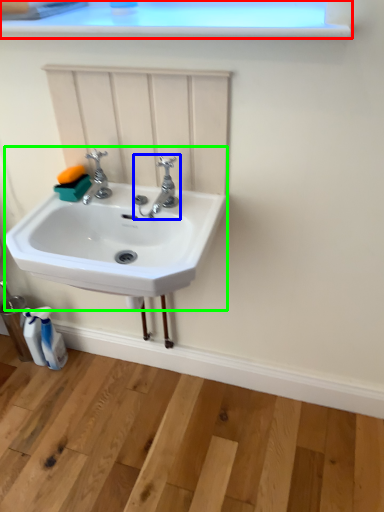
Question: Considering the real-world distances, which object is farthest from window frame (highlighted by a red box)? tap (highlighted by a blue box) or sink (highlighted by a green box)?

Choices:
 (A) tap
 (B) sink

Answer: (B)